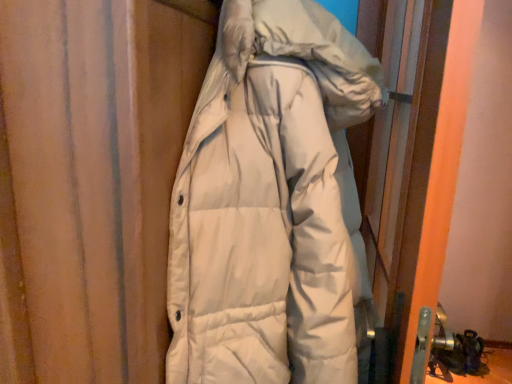
Question: Is white down jacket at center closer to camera compared to white matte screen door at right?

Choices:
 (A) no
 (B) yes

Answer: (B)

Question: Is white down jacket at center positioned behind white matte screen door at right?

Choices:
 (A) no
 (B) yes

Answer: (A)

Question: Considering the relative positions of white down jacket at center and white matte screen door at right in the image provided, is white down jacket at center to the left of white matte screen door at right from the viewer's perspective?

Choices:
 (A) no
 (B) yes

Answer: (B)

Question: From a real-world perspective, is white down jacket at center beneath white matte screen door at right?

Choices:
 (A) yes
 (B) no

Answer: (B)

Question: Is white down jacket at center in contact with white matte screen door at right?

Choices:
 (A) no
 (B) yes

Answer: (A)

Question: Can you confirm if white down jacket at center is bigger than white matte screen door at right?

Choices:
 (A) no
 (B) yes

Answer: (B)

Question: From a real-world perspective, is white matte screen door at right positioned under white down jacket at center based on gravity?

Choices:
 (A) yes
 (B) no

Answer: (A)

Question: Is white matte screen door at right thinner than white down jacket at center?

Choices:
 (A) yes
 (B) no

Answer: (A)

Question: Does white matte screen door at right lie behind white down jacket at center?

Choices:
 (A) yes
 (B) no

Answer: (A)

Question: Considering the relative sizes of white matte screen door at right and white down jacket at center in the image provided, is white matte screen door at right wider than white down jacket at center?

Choices:
 (A) no
 (B) yes

Answer: (A)

Question: Can you see white matte screen door at right touching white down jacket at center?

Choices:
 (A) yes
 (B) no

Answer: (B)

Question: Considering the relative sizes of white matte screen door at right and white down jacket at center in the image provided, is white matte screen door at right bigger than white down jacket at center?

Choices:
 (A) yes
 (B) no

Answer: (B)

Question: In the image, is white matte screen door at right positioned in front of or behind white down jacket at center?

Choices:
 (A) behind
 (B) front

Answer: (A)